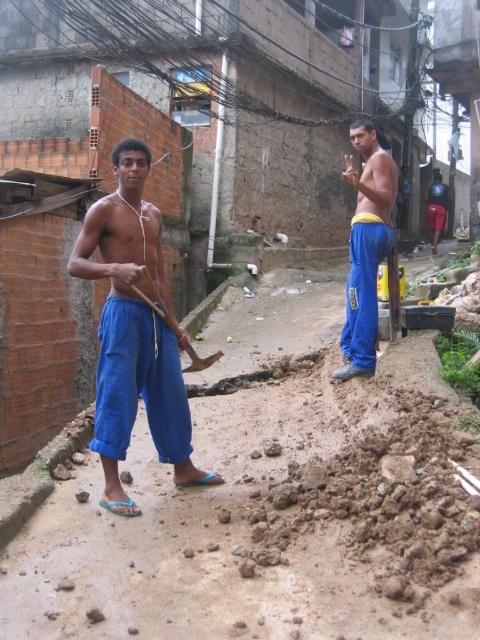
Question: Which point appears farthest from the camera in this image?

Choices:
 (A) (168, 321)
 (B) (113, 404)

Answer: (A)

Question: Does blue cotton pants at left come in front of wooden handle shovel at center?

Choices:
 (A) no
 (B) yes

Answer: (B)

Question: Estimate the real-world distances between objects in this image. Which object is closer to the blue cotton pants at left?

Choices:
 (A) wooden handle shovel at center
 (B) blue cotton pants at center

Answer: (A)

Question: Based on their relative distances, which object is farther from the wooden handle shovel at center?

Choices:
 (A) blue cotton pants at center
 (B) blue cotton pants at left

Answer: (A)

Question: In this image, where is blue cotton pants at center located relative to wooden handle shovel at center?

Choices:
 (A) above
 (B) below

Answer: (A)

Question: Is blue cotton pants at left to the right of blue cotton pants at center from the viewer's perspective?

Choices:
 (A) no
 (B) yes

Answer: (A)